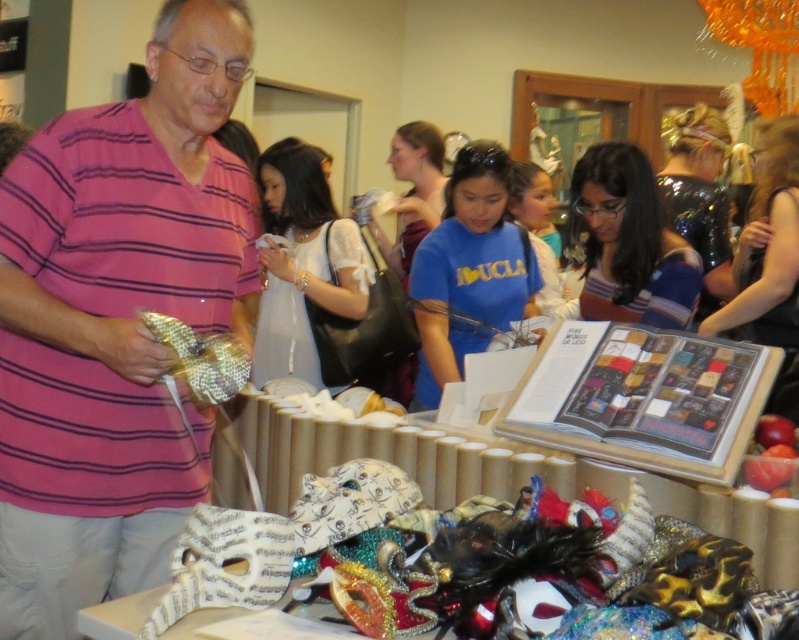
You are at a costume party and need to choose a shirt to wear. You see a pink striped shirt at center and a striped fabric shirt at center. Which shirt is taller?

The pink striped shirt at center is taller than the striped fabric shirt at center.

You are organizing a costume party and have two shirts on a table in the foreground of the scene described. The shirts are a pink striped shirt at center and a striped fabric shirt at center. Which shirt is wider?

The pink striped shirt at center is wider than the striped fabric shirt at center according to the description.